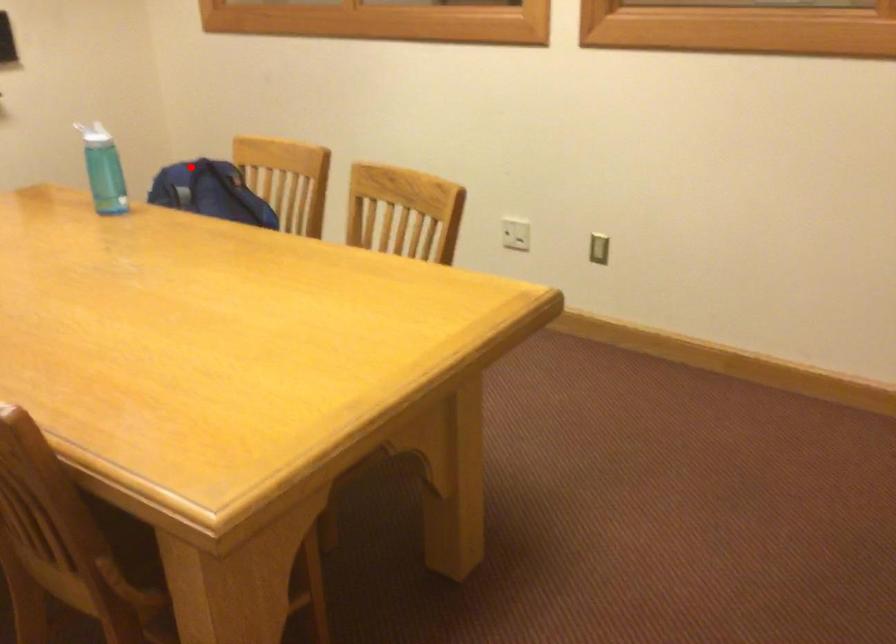
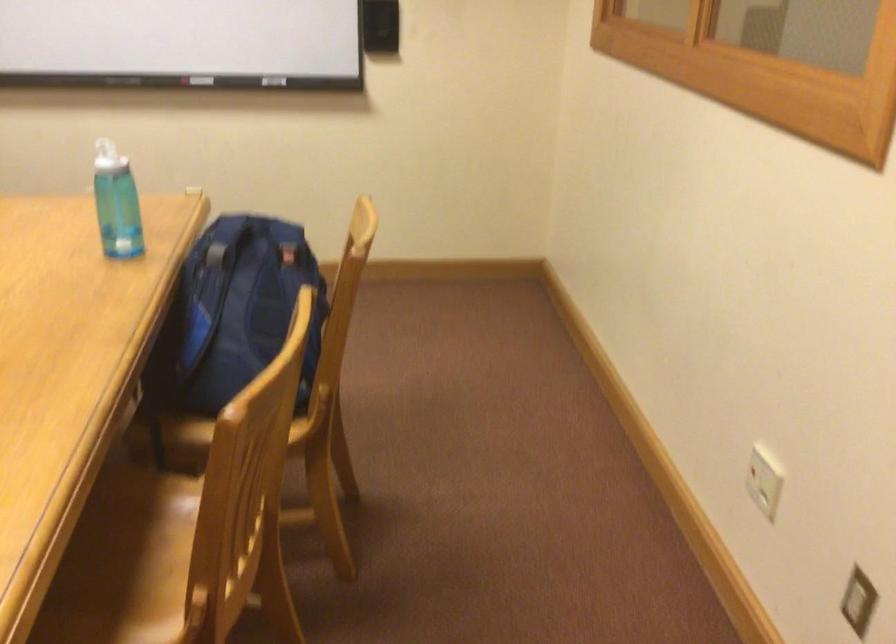
Find the pixel in the second image that matches the highlighted location in the first image.

(254, 225)